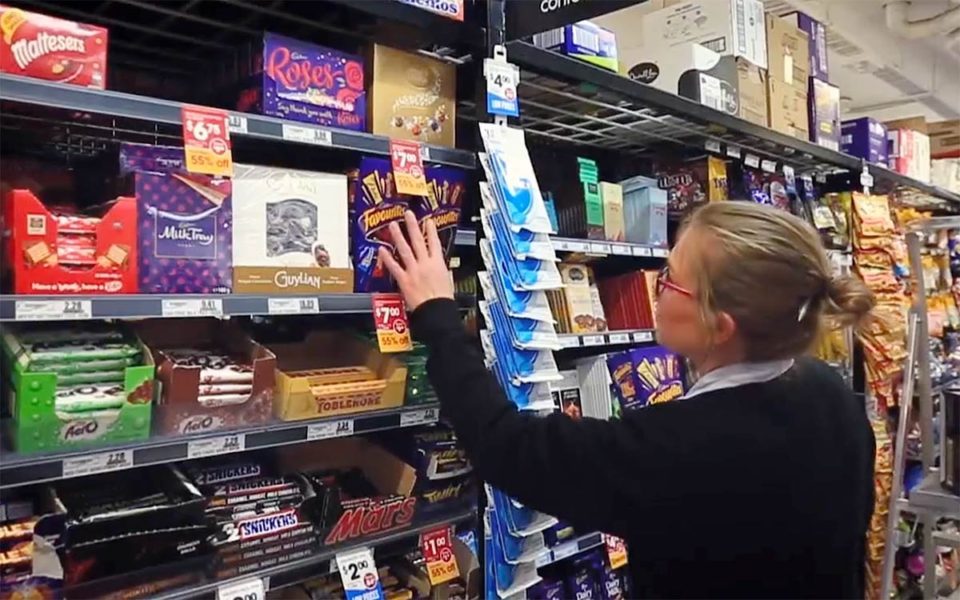
You are a GUI agent. You are given a task and a screenshot of the screen. Output one action in this format:
    pyautogui.click(x=<x>, y=<y>)
    Task: Click on the shelf
    Image resolution: width=960 pixels, height=600 pixels.
    Given the screenshot: What is the action you would take?
    pyautogui.click(x=602, y=98), pyautogui.click(x=103, y=96), pyautogui.click(x=125, y=299), pyautogui.click(x=156, y=443), pyautogui.click(x=296, y=569), pyautogui.click(x=574, y=237), pyautogui.click(x=608, y=342)